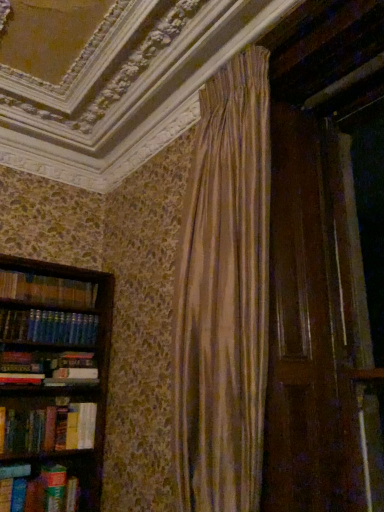
Question: Considering the relative positions of green matte paperback book at lower left and hardcover book at left in the image provided, is green matte paperback book at lower left in front of hardcover book at left?

Choices:
 (A) yes
 (B) no

Answer: (B)

Question: Considering the relative sizes of green matte paperback book at lower left and hardcover book at left in the image provided, is green matte paperback book at lower left wider than hardcover book at left?

Choices:
 (A) no
 (B) yes

Answer: (B)

Question: Is green matte paperback book at lower left shorter than hardcover book at left?

Choices:
 (A) no
 (B) yes

Answer: (A)

Question: Would you say green matte paperback book at lower left is a long distance from hardcover book at left?

Choices:
 (A) no
 (B) yes

Answer: (A)

Question: Can you confirm if green matte paperback book at lower left is smaller than hardcover book at left?

Choices:
 (A) no
 (B) yes

Answer: (B)

Question: Is green matte paperback book at lower left oriented towards hardcover book at left?

Choices:
 (A) yes
 (B) no

Answer: (B)

Question: Considering the relative positions of hardcover book at left and green matte paperback book at lower left in the image provided, is hardcover book at left to the left of green matte paperback book at lower left from the viewer's perspective?

Choices:
 (A) no
 (B) yes

Answer: (B)

Question: From a real-world perspective, is hardcover book at left beneath green matte paperback book at lower left?

Choices:
 (A) yes
 (B) no

Answer: (A)

Question: Considering the relative sizes of hardcover book at left and green matte paperback book at lower left in the image provided, is hardcover book at left bigger than green matte paperback book at lower left?

Choices:
 (A) yes
 (B) no

Answer: (A)

Question: Is hardcover book at left far away from green matte paperback book at lower left?

Choices:
 (A) no
 (B) yes

Answer: (A)

Question: Does hardcover book at left have a lesser width compared to green matte paperback book at lower left?

Choices:
 (A) yes
 (B) no

Answer: (A)

Question: Is hardcover book at left aimed at green matte paperback book at lower left?

Choices:
 (A) no
 (B) yes

Answer: (A)

Question: Is hardcover book at left spatially inside green matte paperback book at lower left, or outside of it?

Choices:
 (A) inside
 (B) outside

Answer: (B)